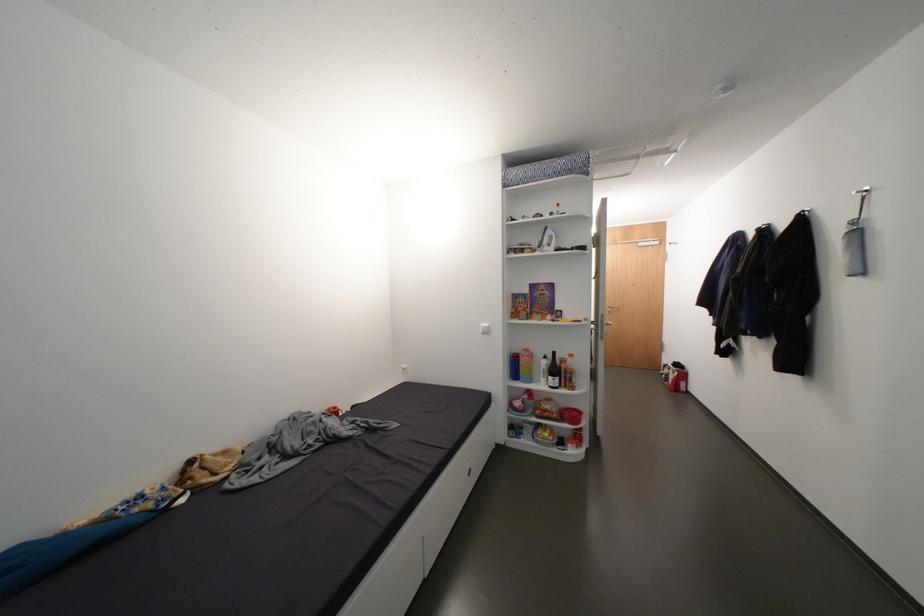
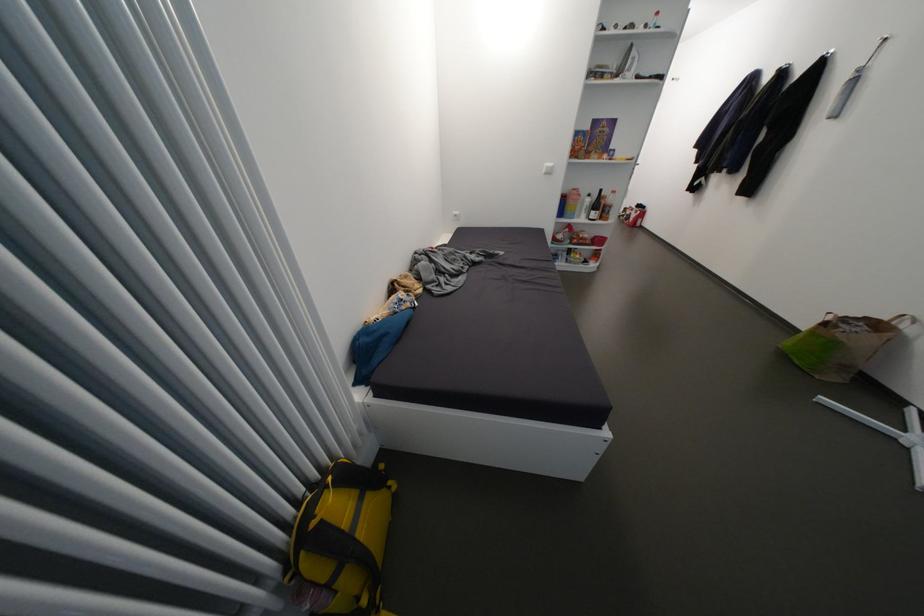
Question: I am providing you with two images of the same scene from different viewpoints. Please identify which objects are invisible in image2.

Choices:
 (A) white plastic bottle
 (B) yellow backpack
 (C) white spray bottle
 (D) none of these

Answer: (D)